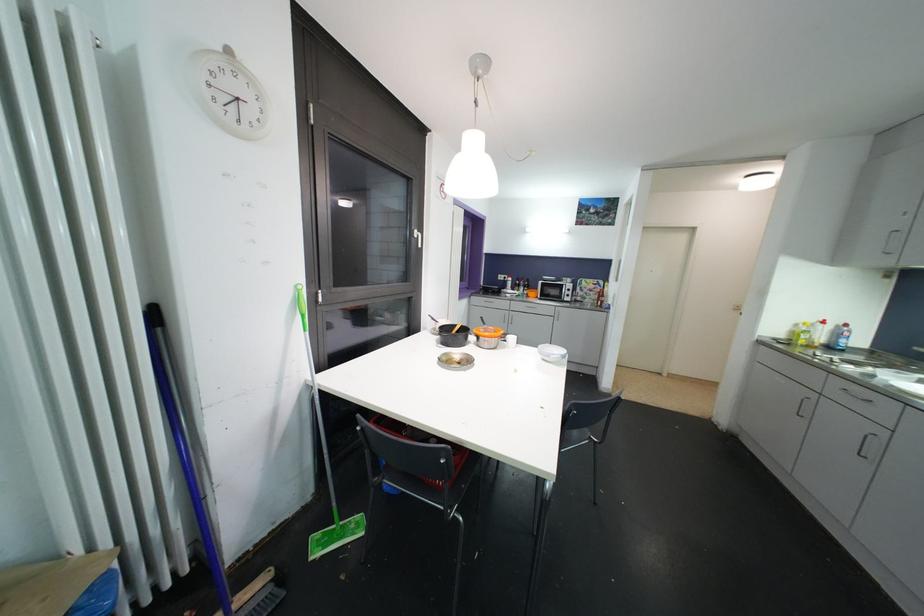
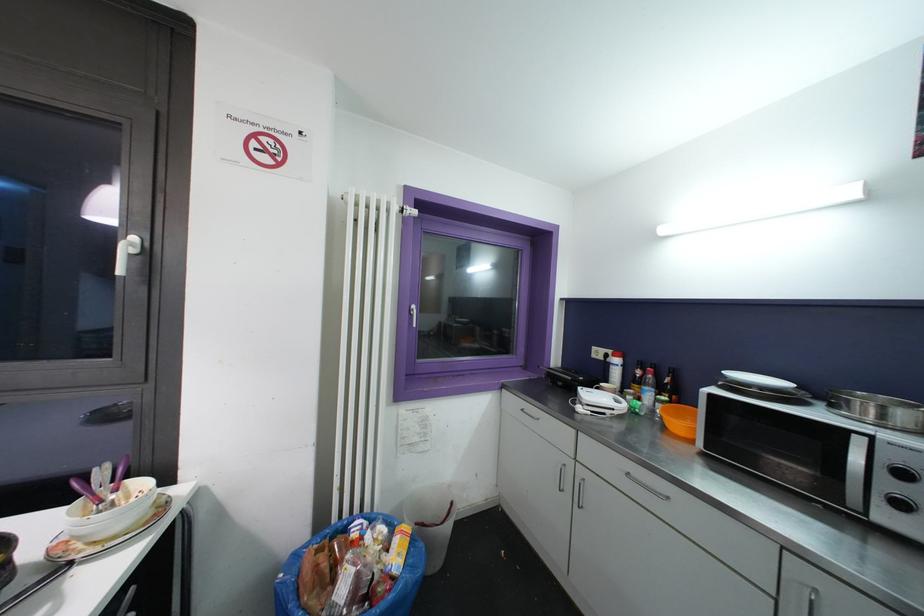
In the second image, find the point that corresponds to pixel 570 299 in the first image.

(904, 508)